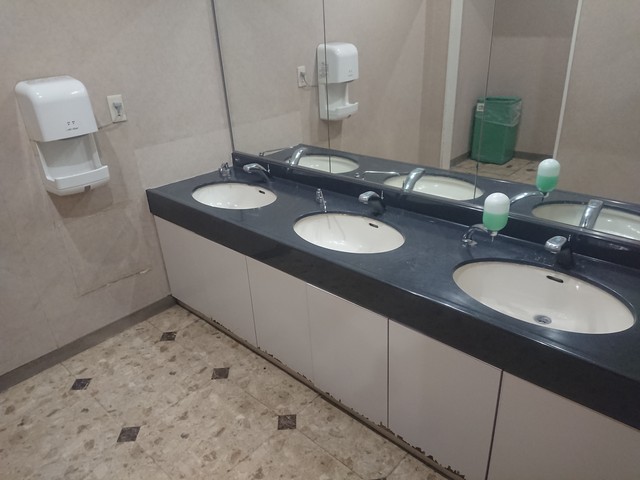
Identify the location of floor. Image resolution: width=640 pixels, height=480 pixels. (170, 406).